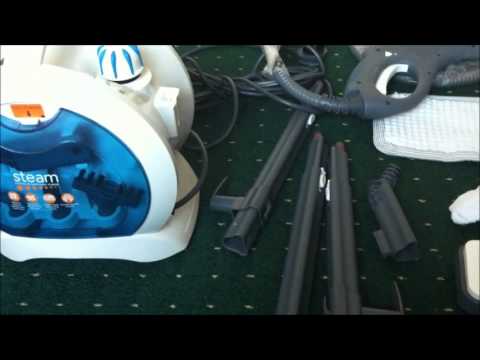
The image size is (480, 360). Find the location of `steam cleaner power indicator`. steam cleaner power indicator is located at coordinates (36, 109).